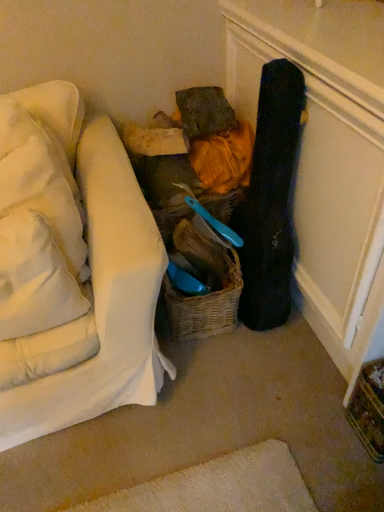
Question: Looking at the image, does white soft pillow at left, arranged as the 2th pillow when ordered from the bottom, seem bigger or smaller compared to woven brown basket at center, placed as the 2th basket when sorted from top to bottom?

Choices:
 (A) big
 (B) small

Answer: (A)

Question: From the image's perspective, is white soft pillow at left, arranged as the 2th pillow when ordered from the bottom, located above or below woven brown basket at center, placed as the first basket when sorted from bottom to top?

Choices:
 (A) above
 (B) below

Answer: (A)

Question: Which is farther from the black matte guitar case at right?

Choices:
 (A) white soft pillow at upper left, the third pillow from the bottom
 (B) white soft pillow at left, positioned as the third pillow in top-to-bottom order
 (C) white soft pillow at left, arranged as the 2th pillow when ordered from the bottom
 (D) woven brown basket at center, marked as the second basket in a bottom-to-top arrangement
 (E) woven brown basket at center, placed as the first basket when sorted from bottom to top

Answer: (A)

Question: Based on their relative distances, which object is farther from the white soft pillow at upper left, the third pillow from the bottom?

Choices:
 (A) white soft pillow at left, positioned as the 2th pillow in top-to-bottom order
 (B) woven brown basket at center, placed as the first basket when sorted from bottom to top
 (C) black matte guitar case at right
 (D) white soft pillow at left, marked as the first pillow in a bottom-to-top arrangement
 (E) woven brown basket at center, placed as the first basket when sorted from top to bottom

Answer: (C)